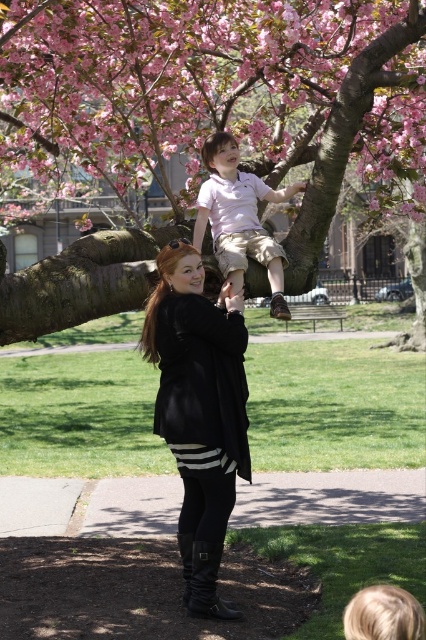
You are standing in the outdoor scene under the blossoming tree. You notice two points marked in the image. The first point is at coordinates point (100, 125) and the second is at point (238, 260). Which of these two points is closer to you?

Point (100, 125) is closer to you because it is further to the camera than point (238, 260).

Based on the coordinates provided, can you identify which object is located at point (230,129) in the image?

The point (230,129) corresponds to the pink blossom tree at upper center.